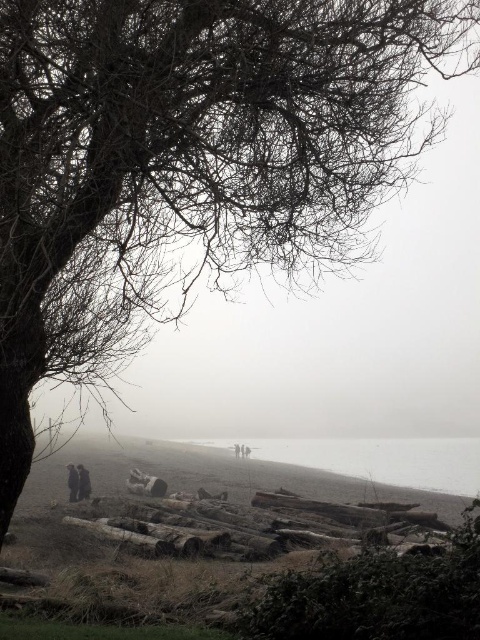
Who is lower down, dark brown leather jacket at lower left or dark gray fabric jacket at lower left?

dark gray fabric jacket at lower left is lower down.

Who is more distant from viewer, (80, 474) or (69, 483)?

Positioned behind is point (80, 474).

The image size is (480, 640). What are the coordinates of `dark brown leather jacket at lower left` in the screenshot? It's located at (83, 483).

Is point (243, 532) in front of point (346, 451)?

Yes, it is.

Does point (436, 620) come behind point (248, 442)?

That is False.

Is point (302, 502) closer to camera compared to point (348, 454)?

Yes, it is in front of point (348, 454).

Locate an element on the screen. This screenshot has width=480, height=640. wooden logs at lower center is located at coordinates (240, 552).

Is gray foggy water at lower center thinner than dark gray fabric jacket at lower left?

Incorrect, gray foggy water at lower center's width is not less than dark gray fabric jacket at lower left's.

Which is more to the right, gray foggy water at lower center or dark gray fabric jacket at lower left?

Positioned to the right is gray foggy water at lower center.

Who is more forward, (396, 477) or (70, 474)?

Point (70, 474) is more forward.

Locate an element on the screen. The height and width of the screenshot is (640, 480). gray foggy water at lower center is located at coordinates (373, 458).